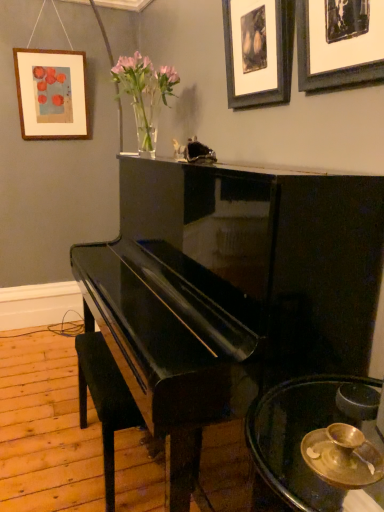
Question: Does black matte picture frame at upper right, which is the 3th picture frame in back-to-front order, lie behind wooden picture frame at upper left, the third picture frame in the right-to-left sequence?

Choices:
 (A) yes
 (B) no

Answer: (B)

Question: Is black matte picture frame at upper right, the first picture frame when ordered from right to left, completely or partially outside of wooden picture frame at upper left, which is counted as the first picture frame, starting from the back?

Choices:
 (A) yes
 (B) no

Answer: (A)

Question: From a real-world perspective, is black matte picture frame at upper right, which appears as the 3th picture frame when viewed from the left, positioned over wooden picture frame at upper left, which is counted as the first picture frame, starting from the back, based on gravity?

Choices:
 (A) no
 (B) yes

Answer: (B)

Question: Is wooden picture frame at upper left, the third picture frame in the right-to-left sequence, inside black matte picture frame at upper right, which ranks as the 1th picture frame in front-to-back order?

Choices:
 (A) yes
 (B) no

Answer: (B)

Question: Considering the relative sizes of black matte picture frame at upper right, which is the 3th picture frame in back-to-front order, and wooden picture frame at upper left, placed as the 1th picture frame when sorted from left to right, in the image provided, is black matte picture frame at upper right, which is the 3th picture frame in back-to-front order, thinner than wooden picture frame at upper left, placed as the 1th picture frame when sorted from left to right,?

Choices:
 (A) yes
 (B) no

Answer: (A)

Question: From a real-world perspective, relative to glossy black piano at center, is black leather music stool at lower left vertically above or below?

Choices:
 (A) above
 (B) below

Answer: (B)

Question: From the image's perspective, is black leather music stool at lower left positioned above or below glossy black piano at center?

Choices:
 (A) below
 (B) above

Answer: (A)

Question: Considering their positions, is black leather music stool at lower left located in front of or behind glossy black piano at center?

Choices:
 (A) behind
 (B) front

Answer: (A)

Question: Visually, is black leather music stool at lower left positioned to the left or to the right of glossy black piano at center?

Choices:
 (A) right
 (B) left

Answer: (B)

Question: From a real-world perspective, relative to black leather music stool at lower left, is wooden picture frame at upper left, placed as the 1th picture frame when sorted from left to right, vertically above or below?

Choices:
 (A) below
 (B) above

Answer: (B)

Question: Which is correct: wooden picture frame at upper left, placed as the 1th picture frame when sorted from left to right, is inside black leather music stool at lower left, or outside of it?

Choices:
 (A) inside
 (B) outside

Answer: (B)

Question: Based on their sizes in the image, would you say wooden picture frame at upper left, the third picture frame in the right-to-left sequence, is bigger or smaller than black leather music stool at lower left?

Choices:
 (A) small
 (B) big

Answer: (A)

Question: From the image's perspective, is wooden picture frame at upper left, placed as the 3th picture frame when sorted from front to back, located above or below black leather music stool at lower left?

Choices:
 (A) below
 (B) above

Answer: (B)

Question: From a real-world perspective, relative to glossy black piano at center, is gold metallic bowl at lower right vertically above or below?

Choices:
 (A) below
 (B) above

Answer: (B)

Question: Relative to glossy black piano at center, is gold metallic bowl at lower right in front or behind?

Choices:
 (A) behind
 (B) front

Answer: (B)